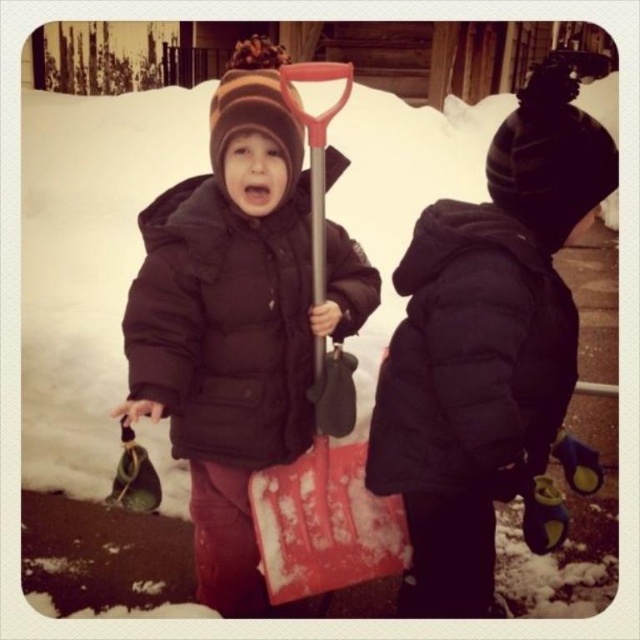
Does black matte jacket at center appear on the right side of matte black jacket at center?

Yes, black matte jacket at center is to the right of matte black jacket at center.

Measure the distance between black matte jacket at center and matte black jacket at center.

black matte jacket at center is 24.32 inches away from matte black jacket at center.

The width and height of the screenshot is (640, 640). What do you see at coordinates (488, 352) in the screenshot?
I see `black matte jacket at center` at bounding box center [488, 352].

Where is `black matte jacket at center`? The width and height of the screenshot is (640, 640). black matte jacket at center is located at coordinates (488, 352).

Can you confirm if matte black jacket at center is bigger than red plastic shovel at center?

Yes.

Is matte black jacket at center positioned before red plastic shovel at center?

Yes, matte black jacket at center is closer to the viewer.

This screenshot has height=640, width=640. What are the coordinates of `matte black jacket at center` in the screenshot? It's located at (237, 321).

Does black matte jacket at center have a lesser height compared to red plastic shovel at center?

No, black matte jacket at center is not shorter than red plastic shovel at center.

Which is below, black matte jacket at center or red plastic shovel at center?

Positioned lower is black matte jacket at center.

Between point (525, 403) and point (280, 580), which one is positioned behind?

The point (280, 580) is behind.

Identify the location of black matte jacket at center. (488, 352).